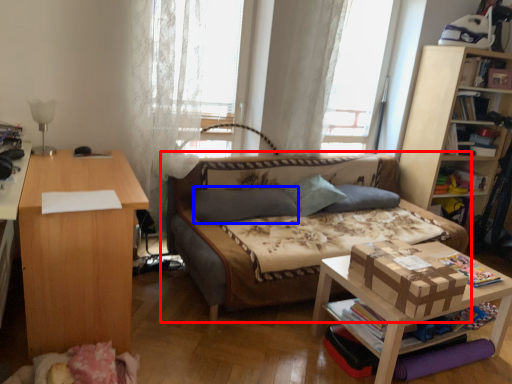
Question: Which object appears closest to the camera in this image, studio couch (highlighted by a red box) or pillow (highlighted by a blue box)?

Choices:
 (A) studio couch
 (B) pillow

Answer: (A)